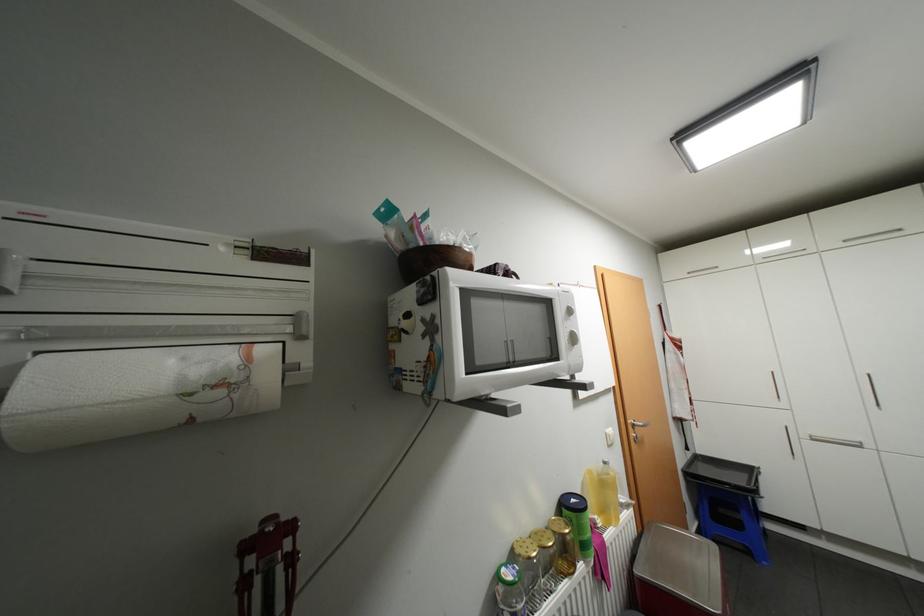
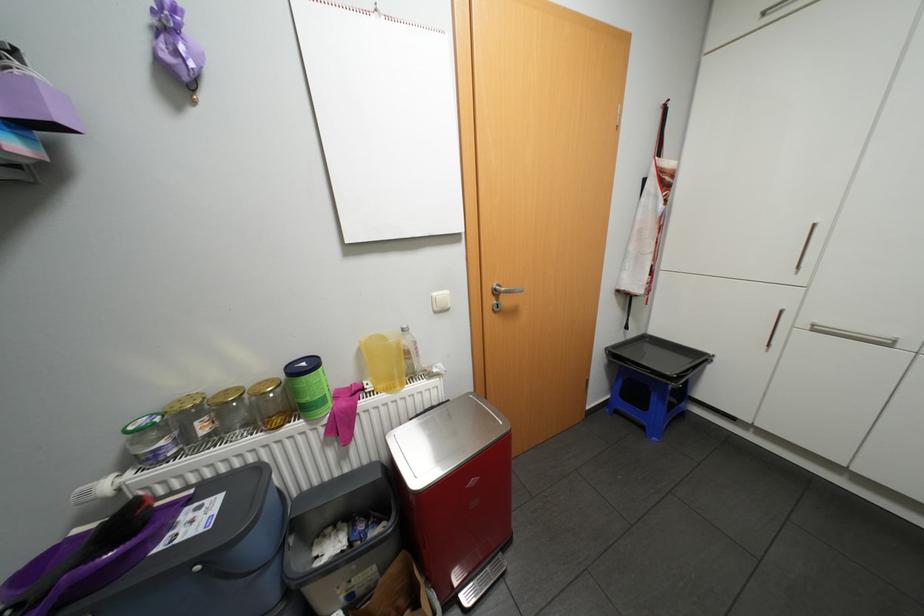
Locate, in the second image, the point that corresponds to point (652, 583) in the first image.

(395, 446)